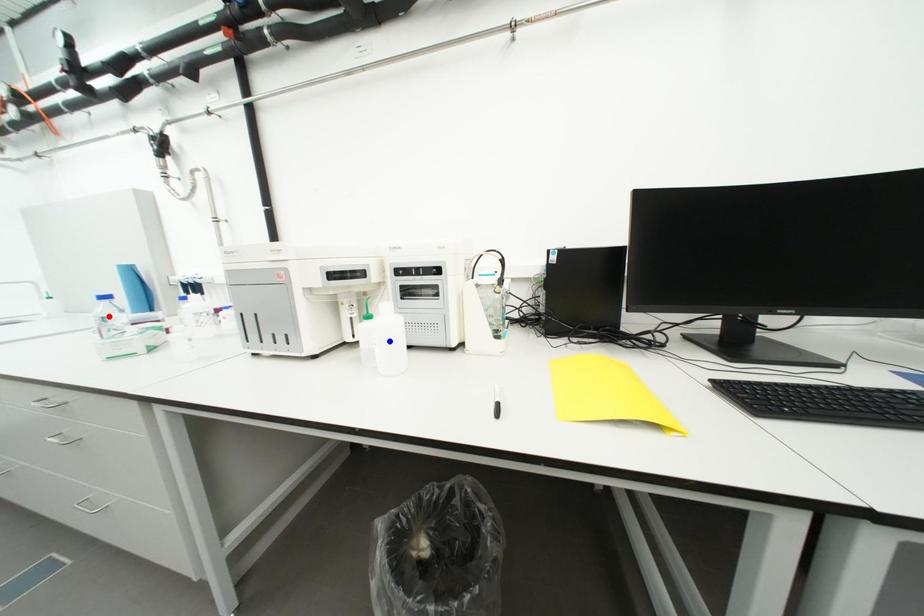
Question: In the image, two points are highlighted. Which point is nearer to the camera? Reply with the corresponding letter.

Choices:
 (A) blue point
 (B) red point

Answer: (A)